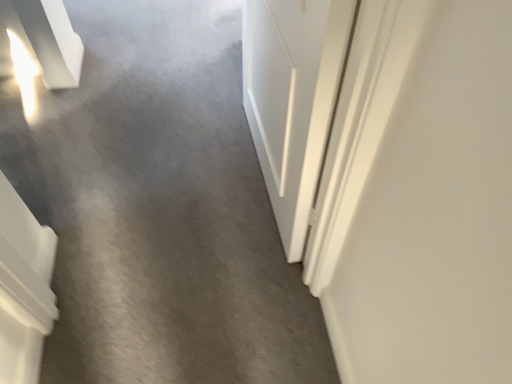
What do you see at coordinates (160, 208) in the screenshot? I see `gray carpet at center` at bounding box center [160, 208].

The width and height of the screenshot is (512, 384). What are the coordinates of `gray carpet at center` in the screenshot? It's located at (160, 208).

Where is `gray carpet at center`? gray carpet at center is located at coordinates (160, 208).